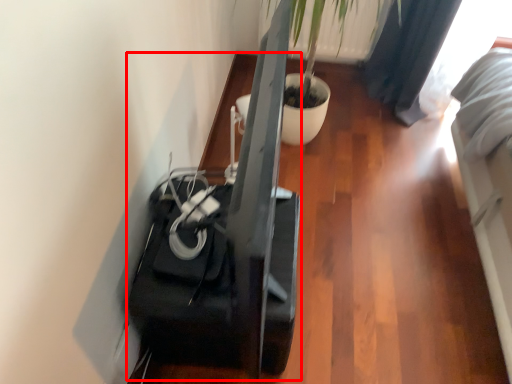
Question: From the image, what is the correct spatial relationship of furniture (annotated by the red box) in relation to plant?

Choices:
 (A) right
 (B) left

Answer: (B)